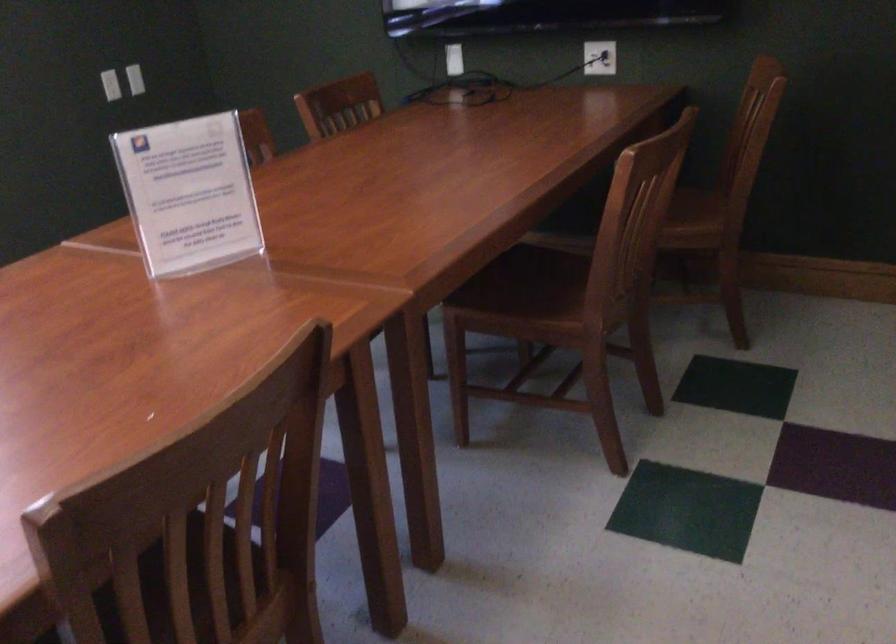
Identify the location of white electrical outlet. (599, 58).